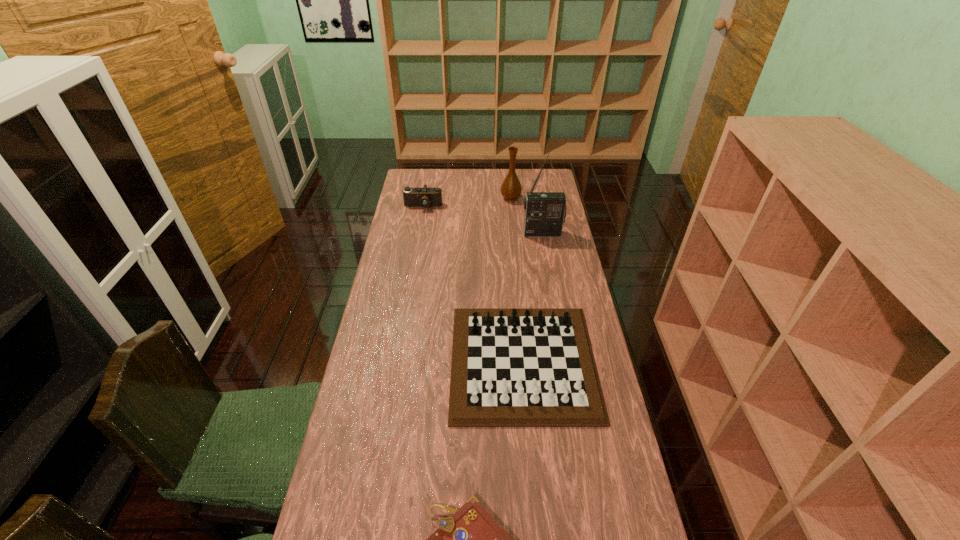
Identify the location of radio receiver. Image resolution: width=960 pixels, height=540 pixels. pos(545,212).

Where is `the tallest object`? Image resolution: width=960 pixels, height=540 pixels. the tallest object is located at coordinates (545, 212).

Where is `the second tallest object`? This screenshot has height=540, width=960. the second tallest object is located at coordinates (511, 189).

Where is `camera`? camera is located at coordinates (424, 197).

Locate an element on the screen. gameboard is located at coordinates (514, 367).

Where is `free space located 0.070m on the display of the radio receiver`? free space located 0.070m on the display of the radio receiver is located at coordinates (545, 248).

Identify the location of vacant space located on the left of the vase. (475, 198).

At what (x,y) coordinates should I click in order to perform the action: click on vacant space located on the lens of the camera. Please return your answer as a coordinate pair (x, y). Looking at the image, I should click on (413, 264).

Identify the location of free space located 0.220m on the front of the fourth farthest object. (537, 511).

The height and width of the screenshot is (540, 960). Find the location of `object that is at the far edge`. object that is at the far edge is located at coordinates (511, 189).